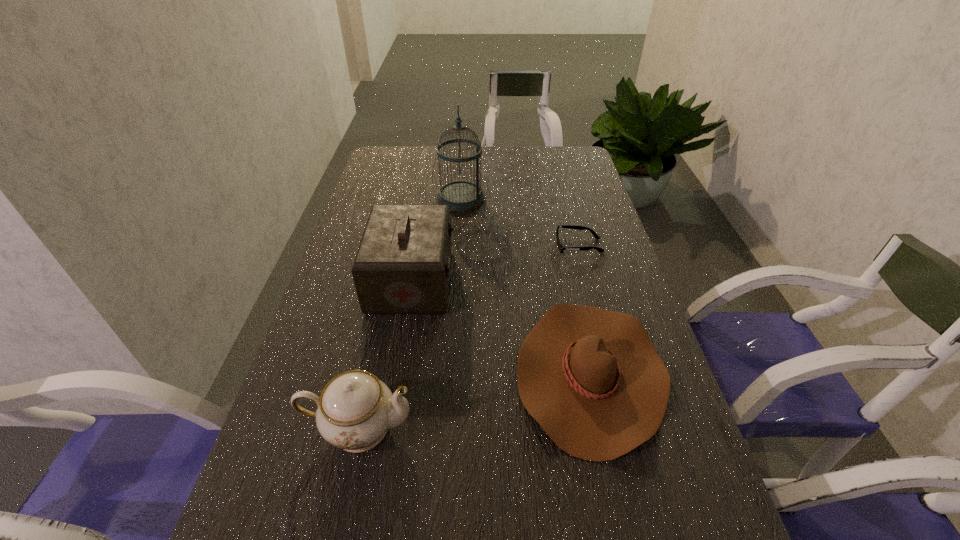
Locate an element on the screen. The height and width of the screenshot is (540, 960). free location located 0.300m on the front-facing side of the shortest object is located at coordinates (454, 246).

Find the location of a particular element. The image size is (960, 540). vacant position located 0.100m on the front-facing side of the shortest object is located at coordinates click(x=522, y=246).

Locate an element on the screen. Image resolution: width=960 pixels, height=540 pixels. vacant point located on the front-facing side of the shortest object is located at coordinates (454, 246).

In order to click on the first-aid kit that is at the left edge in this screenshot , I will do `click(402, 266)`.

Identify the location of chinaware at the left edge. The height and width of the screenshot is (540, 960). (355, 409).

Identify the location of cowboy hat that is positioned at the right edge. click(x=592, y=379).

Where is `sunglasses that is at the right edge`? The width and height of the screenshot is (960, 540). sunglasses that is at the right edge is located at coordinates (560, 247).

Image resolution: width=960 pixels, height=540 pixels. What are the coordinates of `free space at the far edge of the desktop` in the screenshot? It's located at (456, 174).

At what (x,y) coordinates should I click in order to perform the action: click on free spot at the left edge of the desktop. Please return your answer as a coordinate pair (x, y). The image size is (960, 540). Looking at the image, I should click on (337, 284).

Locate an element on the screen. This screenshot has height=540, width=960. free space at the right edge is located at coordinates (646, 513).